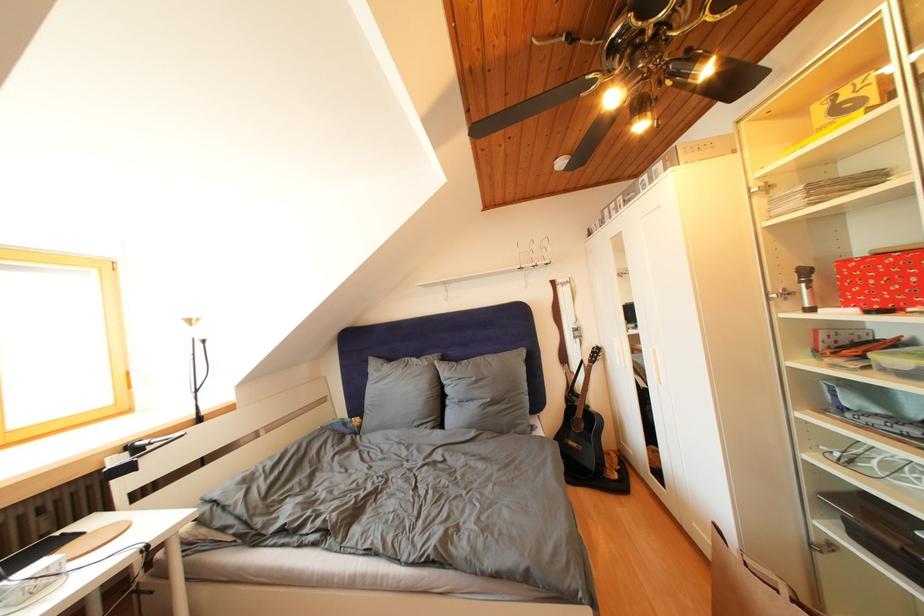
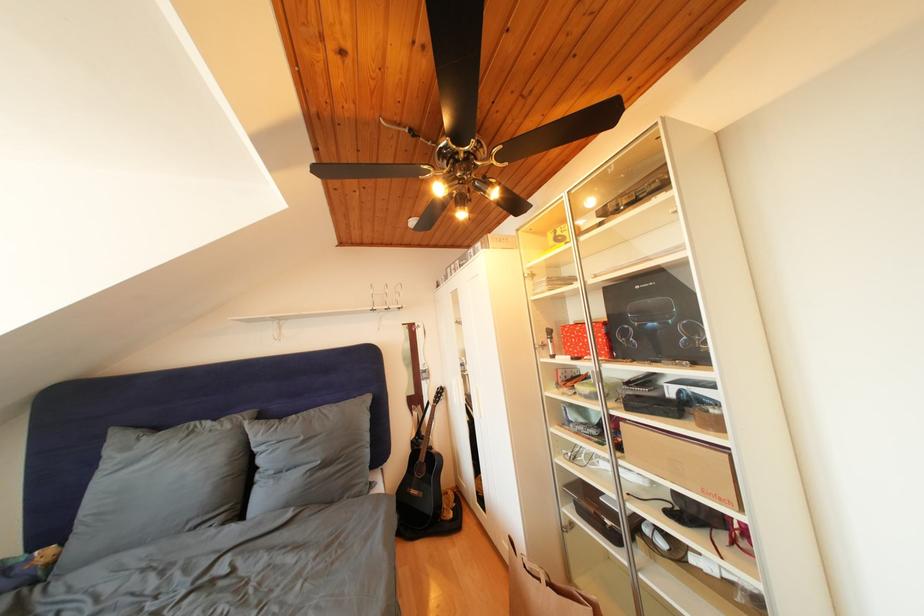
Where in the second image is the point corresponding to [482,384] from the first image?

(310, 444)